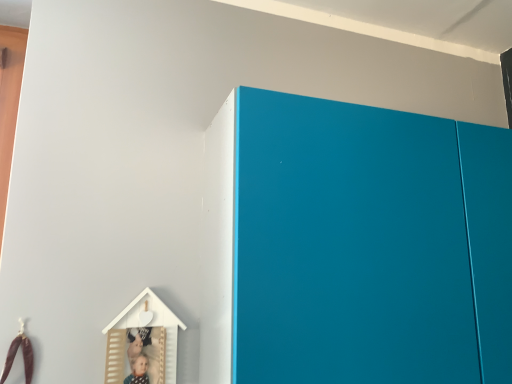
Question: From the image's perspective, would you say white matte wooden house at lower left, arranged as the second toy when viewed from the left, is positioned over matte blue cabinet at upper right?

Choices:
 (A) yes
 (B) no

Answer: (B)

Question: Is matte blue cabinet at upper right at the back of white matte wooden house at lower left, which is the 1th toy from right to left?

Choices:
 (A) no
 (B) yes

Answer: (A)

Question: Is matte blue cabinet at upper right completely or partially inside white matte wooden house at lower left, arranged as the second toy when viewed from the left?

Choices:
 (A) yes
 (B) no

Answer: (B)

Question: Is white matte wooden house at lower left, arranged as the second toy when viewed from the left, far away from matte blue cabinet at upper right?

Choices:
 (A) no
 (B) yes

Answer: (A)

Question: Does white matte wooden house at lower left, which is the 1th toy from right to left, have a larger size compared to matte blue cabinet at upper right?

Choices:
 (A) yes
 (B) no

Answer: (B)

Question: Considering the positions of brown leather toy at lower left, the 1th toy when ordered from left to right, and white matte wooden house at lower left, which is the 1th toy from right to left, in the image, is brown leather toy at lower left, the 1th toy when ordered from left to right, taller or shorter than white matte wooden house at lower left, which is the 1th toy from right to left,?

Choices:
 (A) tall
 (B) short

Answer: (B)

Question: Would you say brown leather toy at lower left, the 2th toy from the right, is to the left or to the right of white matte wooden house at lower left, which is the 1th toy from right to left, in the picture?

Choices:
 (A) left
 (B) right

Answer: (A)

Question: From the image's perspective, is brown leather toy at lower left, the 2th toy from the right, located above or below white matte wooden house at lower left, arranged as the second toy when viewed from the left?

Choices:
 (A) below
 (B) above

Answer: (A)

Question: Looking at their shapes, would you say brown leather toy at lower left, the 2th toy from the right, is wider or thinner than white matte wooden house at lower left, arranged as the second toy when viewed from the left?

Choices:
 (A) thin
 (B) wide

Answer: (A)

Question: Visually, is matte blue cabinet at upper right positioned to the left or to the right of brown leather toy at lower left, the 2th toy from the right?

Choices:
 (A) right
 (B) left

Answer: (A)

Question: In terms of width, does matte blue cabinet at upper right look wider or thinner when compared to brown leather toy at lower left, the 1th toy when ordered from left to right?

Choices:
 (A) thin
 (B) wide

Answer: (B)

Question: Considering the positions of point (440, 306) and point (19, 319), is point (440, 306) closer or farther from the camera than point (19, 319)?

Choices:
 (A) closer
 (B) farther

Answer: (B)

Question: Considering their positions, is matte blue cabinet at upper right located in front of or behind brown leather toy at lower left, the 1th toy when ordered from left to right?

Choices:
 (A) behind
 (B) front

Answer: (B)

Question: Is brown leather toy at lower left, the 2th toy from the right, to the left or to the right of matte blue cabinet at upper right in the image?

Choices:
 (A) right
 (B) left

Answer: (B)

Question: From a real-world perspective, is brown leather toy at lower left, the 2th toy from the right, positioned above or below matte blue cabinet at upper right?

Choices:
 (A) above
 (B) below

Answer: (B)